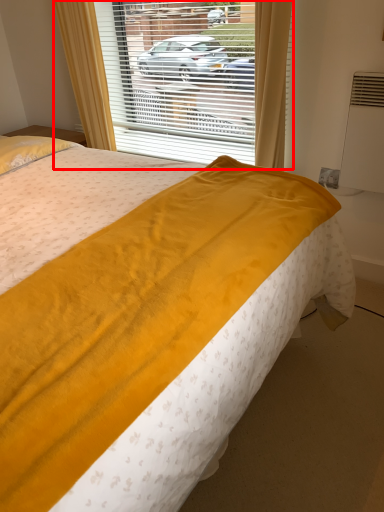
Question: In this image, where is window (annotated by the red box) located relative to bed?

Choices:
 (A) right
 (B) left

Answer: (A)